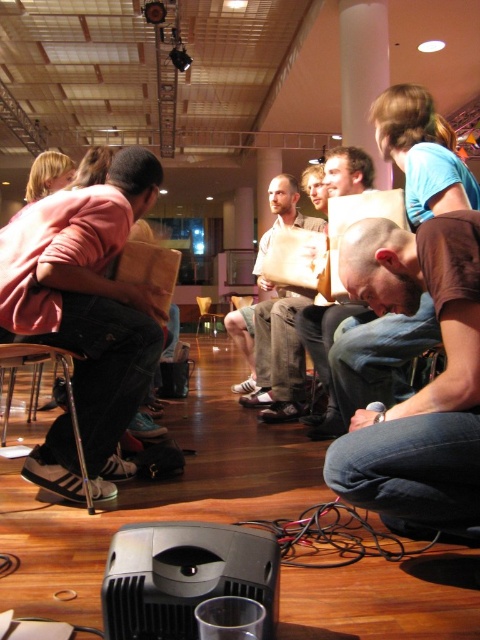
In the scene shown: You are organizing a presentation in this space and need to move the projector from its current position to the left side of the matte pink shirt at left. However, there is a wooden chair at center in the way. Can you move the projector around the chair to reach the desired location?

The matte pink shirt at left is positioned on the right side of the wooden chair at center, so to move the projector to the left of the matte pink shirt at left, you would need to go around the wooden chair at center to the left side, which should be possible as long as there is enough space.

You are organizing a small event and need to ensure there is enough space for both the light brown fabric shirt at center and the wooden chair at center. Based on their sizes, which one requires more space?

The light brown fabric shirt at center requires more space because it has a larger size compared to the wooden chair at center.

You are an event organizer setting up for a presentation. You notice the light brown fabric shirt at center and the wooden chair at center. Which object is covering the other?

The light brown fabric shirt at center is positioned over the wooden chair at center, so it is covering the chair.